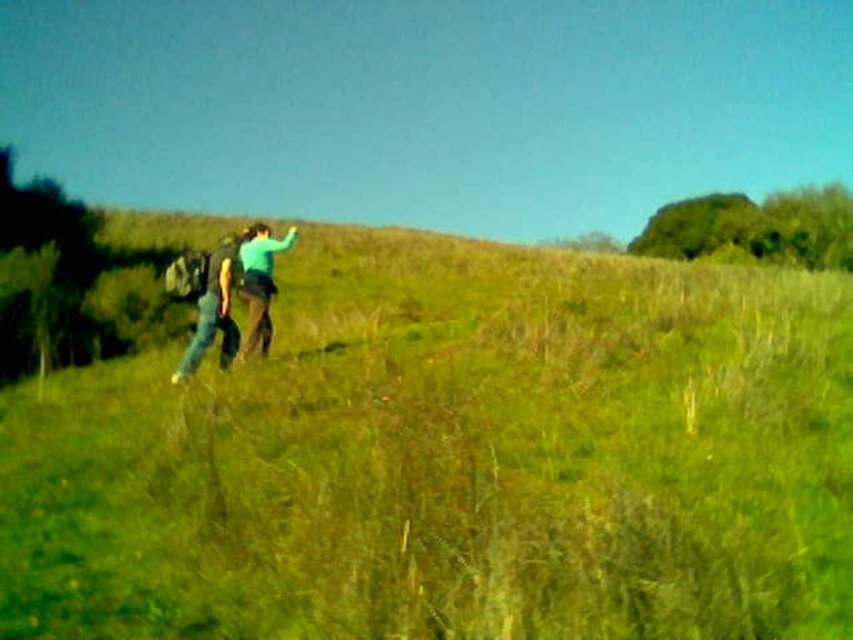
You are planning to set up a small tent for a picnic. The tent requires a flat area wider than the green matte jacket at center. Is the green grassy hillside at center wide enough?

The green grassy hillside at center is wider than the green matte jacket at center, so yes, the hillside is wide enough to accommodate the tent.

Consider the image. You are standing in the rural outdoor scene and want to walk towards the denim pants at left. Which direction should you move relative to the green grassy hillside at center?

You should move towards the denim pants at left, which is closer to the viewer than the green grassy hillside at center, so you would need to walk towards the left side of the scene where the denim pants are located.